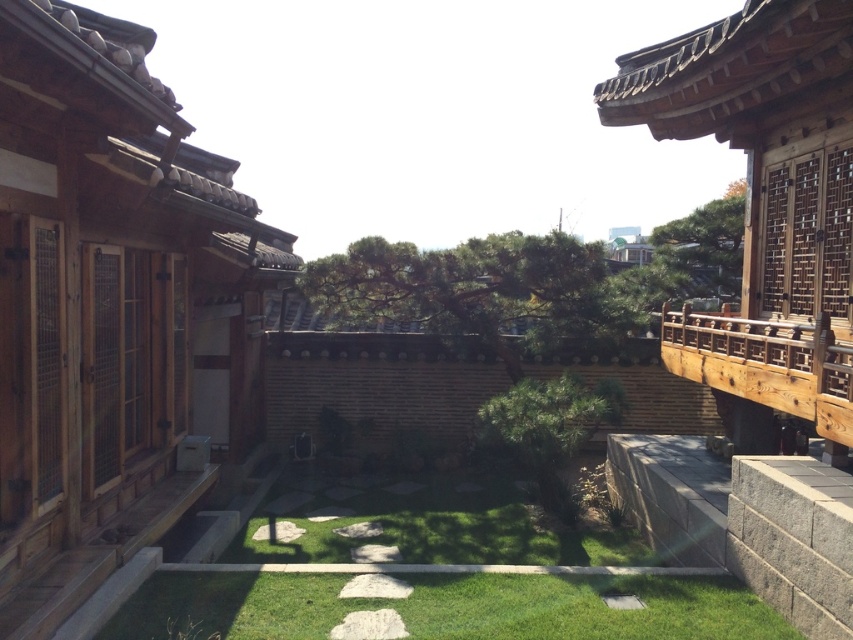
Question: Among these objects, which one is farthest from the camera?

Choices:
 (A) green grass at center
 (B) wooden terrace at left

Answer: (B)

Question: Observing the image, what is the correct spatial positioning of wooden terrace at left in reference to green grass at center?

Choices:
 (A) left
 (B) right

Answer: (A)

Question: Does wooden terrace at left come in front of green grass at center?

Choices:
 (A) yes
 (B) no

Answer: (B)

Question: Is wooden terrace at left in front of green grass at center?

Choices:
 (A) yes
 (B) no

Answer: (B)